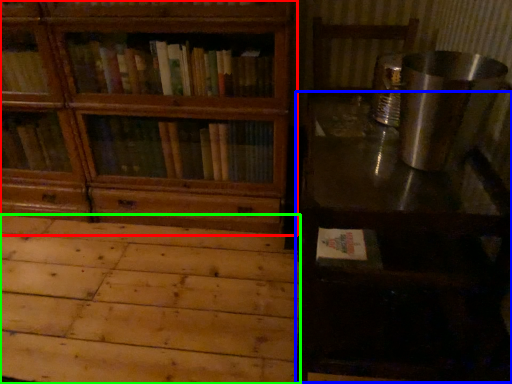
Question: Which object is the closest to the bookcase (highlighted by a red box)? Choose among these: table (highlighted by a blue box) or plywood (highlighted by a green box).

Choices:
 (A) table
 (B) plywood

Answer: (B)